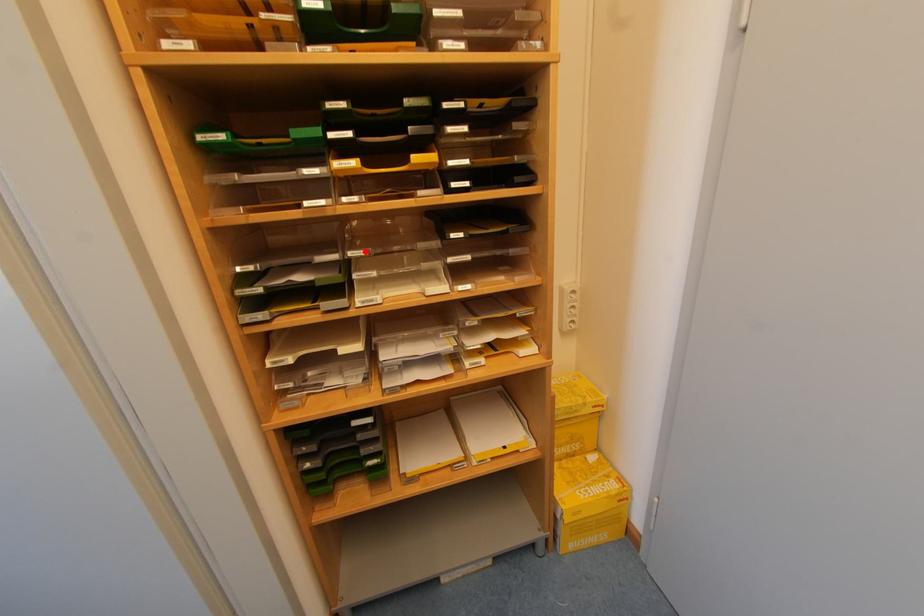
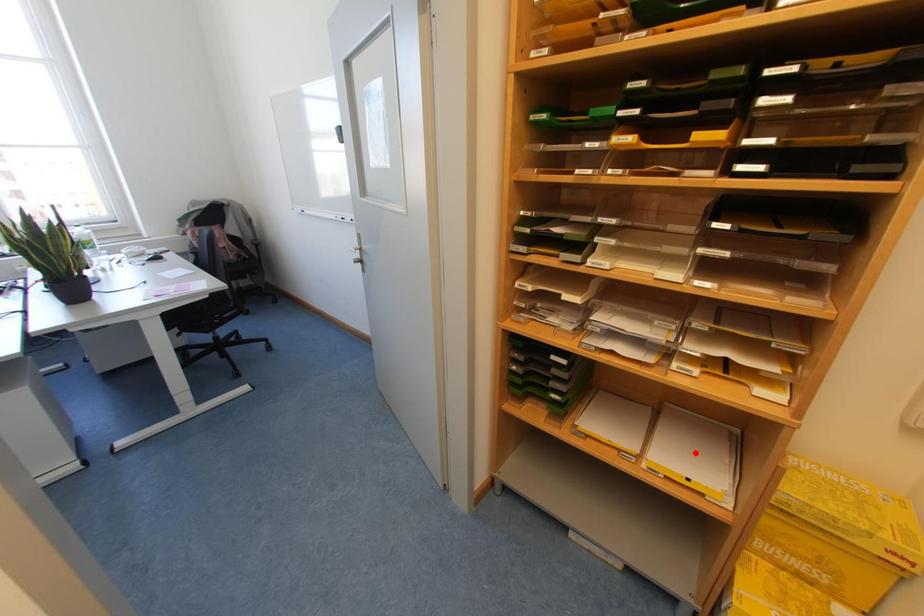
I am providing you with two images of the same scene from different viewpoints. A red point is marked on the first image and another point is marked on the second image. Are the points marked in image1 and image2 representing the same 3D position?

No